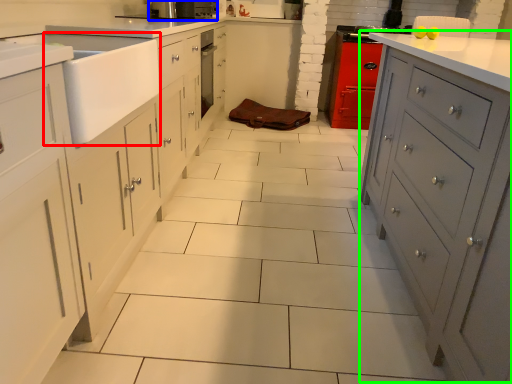
Question: Based on their relative distances, which object is farther from sink (highlighted by a red box)? Choose from home appliance (highlighted by a blue box) and file cabinet (highlighted by a green box).

Choices:
 (A) home appliance
 (B) file cabinet

Answer: (B)